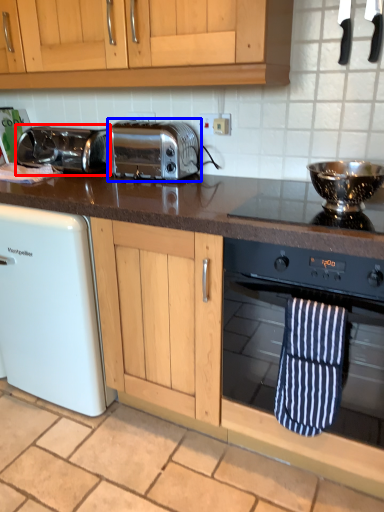
Question: Which point is further to the camera, toaster (highlighted by a red box) or toaster (highlighted by a blue box)?

Choices:
 (A) toaster
 (B) toaster

Answer: (A)